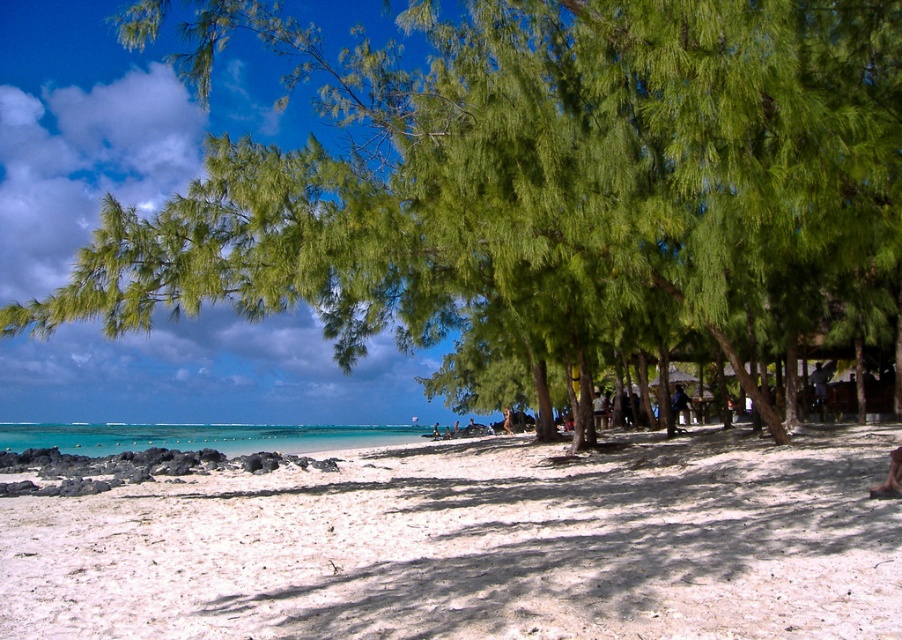
You are standing at the point labeled as point [542,193] on the beach. Looking around, you see the green leafy tree at center. Can you determine the direction of the tree relative to your position?

The point [542,193] indicates the green leafy tree at center, so you are already at the location of the tree. Therefore, the tree is directly at your current position.

You are standing at the beach and want to locate two points marked in the scene. The first point is at coordinates point (444, 144) and the second is at point (875, 429). Which point is nearer to you?

Point (444, 144) is closer to the viewer than point (875, 429).

You are planning to set up a picnic blanket on the beach. The picnic area requires a space that is bigger than the turquoise water at lower left. Can the green leafy tree at center provide enough space for your picnic setup?

The green leafy tree at center is larger in size than the turquoise water at lower left, so it can provide sufficient space for your picnic setup.